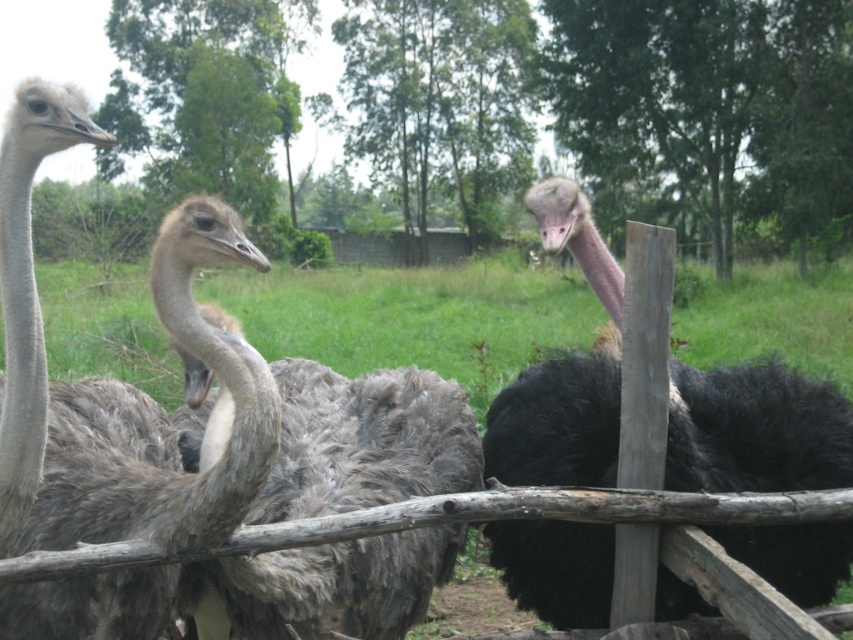
Between black feathered ostrich at center and gray feathered ostrich at center, which one appears on the right side from the viewer's perspective?

From the viewer's perspective, black feathered ostrich at center appears more on the right side.

Does black feathered ostrich at center have a lesser height compared to gray feathered ostrich at center?

No.

Is point (784, 582) farther from camera compared to point (334, 609)?

Yes, point (784, 582) is behind point (334, 609).

The width and height of the screenshot is (853, 640). Identify the location of black feathered ostrich at center. (755, 429).

Is gray feathered ostrich at left taller than black feathered ostrich at center?

Indeed, gray feathered ostrich at left has a greater height compared to black feathered ostrich at center.

From the picture: Is gray feathered ostrich at left above black feathered ostrich at center?

Yes, gray feathered ostrich at left is above black feathered ostrich at center.

What do you see at coordinates (109, 388) in the screenshot? This screenshot has height=640, width=853. I see `gray feathered ostrich at left` at bounding box center [109, 388].

This screenshot has height=640, width=853. I want to click on gray feathered ostrich at left, so click(x=109, y=388).

Who is higher up, gray feathered ostrich at left or gray feathered ostrich at center?

gray feathered ostrich at center is higher up.

The image size is (853, 640). What do you see at coordinates (109, 388) in the screenshot?
I see `gray feathered ostrich at left` at bounding box center [109, 388].

Which is behind, point (234, 433) or point (263, 624)?

Point (263, 624)

The height and width of the screenshot is (640, 853). In order to click on gray feathered ostrich at left in this screenshot , I will do `click(109, 388)`.